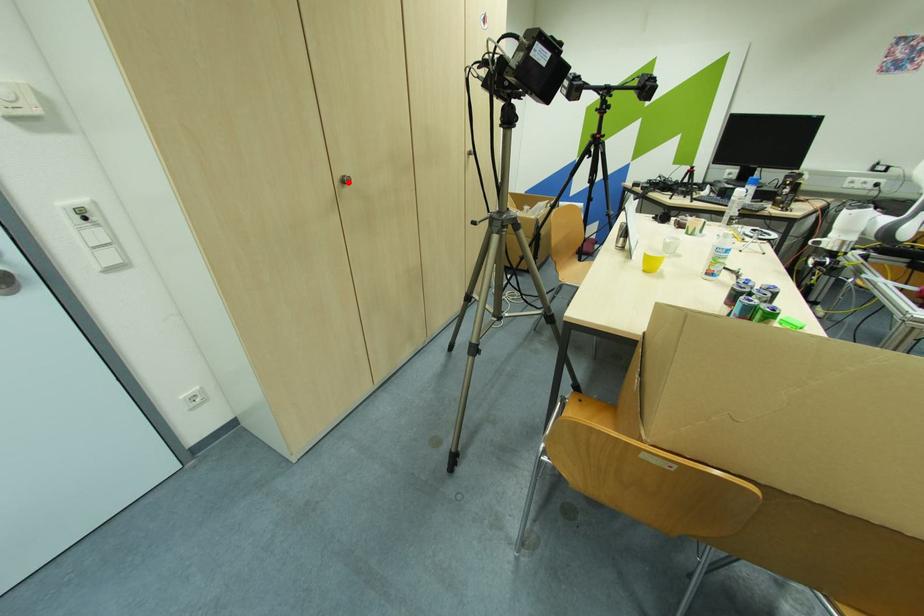
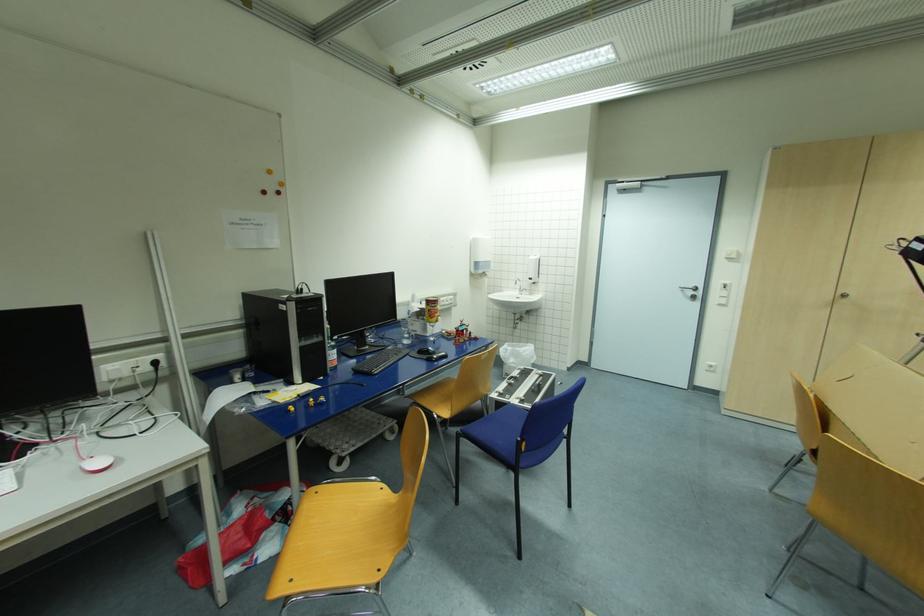
Question: A red point is marked in image1. In image2, is the corresponding 3D point closer to the camera or farther? Reply with the corresponding letter.

Choices:
 (A) The corresponding 3D point is closer.
 (B) The corresponding 3D point is farther.

Answer: (B)